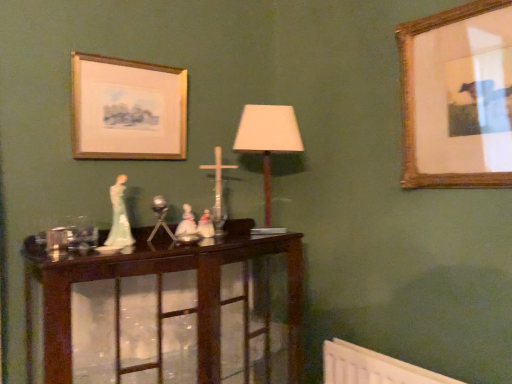
Question: Is white porcelain figurines at center placed right next to wooden picture frame at upper right, arranged as the 2th picture frame when viewed from the left?

Choices:
 (A) no
 (B) yes

Answer: (A)

Question: Does white porcelain figurines at center come in front of wooden picture frame at upper right, which is the 1th picture frame in right-to-left order?

Choices:
 (A) no
 (B) yes

Answer: (A)

Question: Is wooden picture frame at upper right, which is the 1th picture frame in right-to-left order, located within white porcelain figurines at center?

Choices:
 (A) yes
 (B) no

Answer: (B)

Question: Considering the relative sizes of white porcelain figurines at center and wooden picture frame at upper right, arranged as the 2th picture frame when viewed from the left, in the image provided, is white porcelain figurines at center taller than wooden picture frame at upper right, arranged as the 2th picture frame when viewed from the left,?

Choices:
 (A) no
 (B) yes

Answer: (A)

Question: Considering the relative sizes of white porcelain figurines at center and wooden picture frame at upper right, arranged as the 2th picture frame when viewed from the left, in the image provided, is white porcelain figurines at center thinner than wooden picture frame at upper right, arranged as the 2th picture frame when viewed from the left,?

Choices:
 (A) yes
 (B) no

Answer: (B)

Question: From the image's perspective, is dark wood table at center positioned above or below white porcelain figurines at center?

Choices:
 (A) above
 (B) below

Answer: (B)

Question: Does point (71, 284) appear closer or farther from the camera than point (181, 231)?

Choices:
 (A) farther
 (B) closer

Answer: (B)

Question: From their relative heights in the image, would you say dark wood table at center is taller or shorter than white porcelain figurines at center?

Choices:
 (A) tall
 (B) short

Answer: (A)

Question: Is dark wood table at center inside the boundaries of white porcelain figurines at center, or outside?

Choices:
 (A) inside
 (B) outside

Answer: (B)

Question: Is wooden picture frame at upper right, which is the 1th picture frame in right-to-left order, in front of or behind white porcelain figurines at center in the image?

Choices:
 (A) front
 (B) behind

Answer: (A)

Question: In the image, is wooden picture frame at upper right, arranged as the 2th picture frame when viewed from the left, on the left side or the right side of white porcelain figurines at center?

Choices:
 (A) right
 (B) left

Answer: (A)

Question: From a real-world perspective, relative to white porcelain figurines at center, is wooden picture frame at upper right, which is the 1th picture frame in right-to-left order, vertically above or below?

Choices:
 (A) below
 (B) above

Answer: (B)

Question: From the image's perspective, relative to white porcelain figurines at center, is wooden picture frame at upper right, arranged as the 2th picture frame when viewed from the left, above or below?

Choices:
 (A) below
 (B) above

Answer: (B)

Question: From the image's perspective, is dark wood table at center above or below matte white shade at center?

Choices:
 (A) above
 (B) below

Answer: (B)

Question: Visually, is dark wood table at center positioned to the left or to the right of matte white shade at center?

Choices:
 (A) left
 (B) right

Answer: (A)